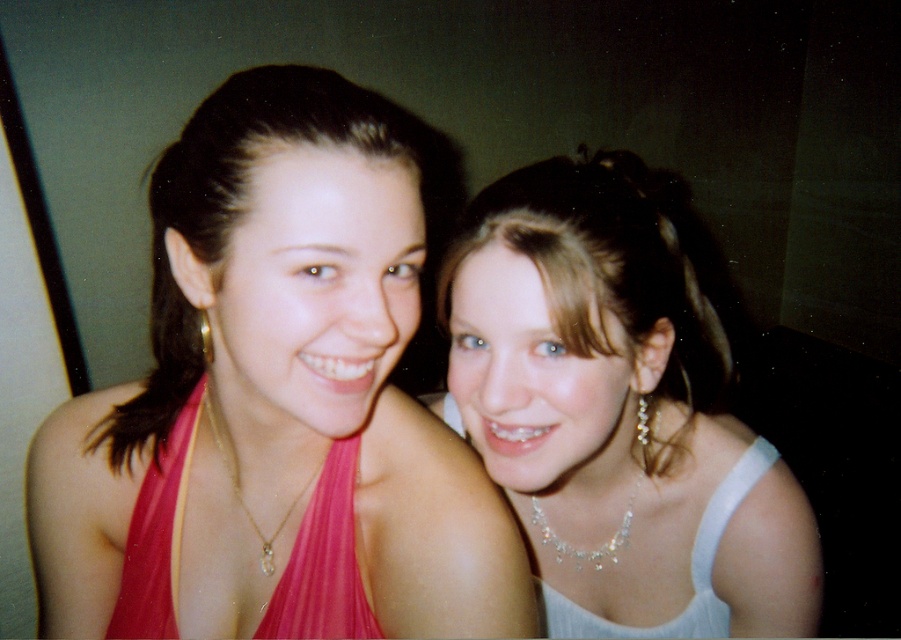
You are taking a photo of two friends. The pink satin halter top at left is represented by point (275, 404). Where should you position the camera to ensure the pink satin halter top at left is centered in the frame?

To center the pink satin halter top at left, position the camera so that the point (275, 404) is at the center of the frame.

You are a photographer setting up a shoot and need to focus on the pink satin halter top at left and the pink satin dress at center. Which one should you adjust your camera focus for first if you want to capture both clearly?

The pink satin halter top at left is closer to the viewer than the pink satin dress at center, so you should focus on the pink satin halter top at left first to ensure both are in focus.

You are a photographer adjusting the camera focus. You notice the pink satin halter top at left and the pearl necklace at upper right in your frame. Which object should you focus on first if you want to ensure both are in focus, considering their vertical positions?

The pink satin halter top at left has a lesser height compared to pearl necklace at upper right. To ensure both are in focus, focus on the pearl necklace at upper right since it is higher and the halter top is lower, allowing the depth of field to cover both.